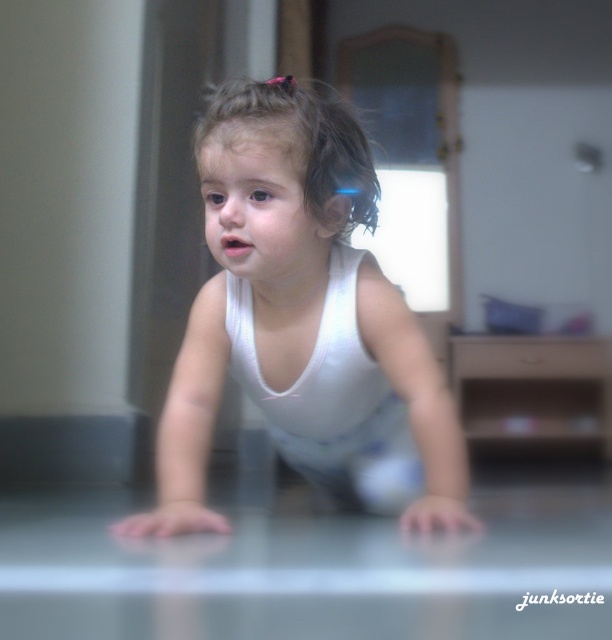
You are a photographer trying to capture a closeup of the white matte toddler at center and the brown curly hair at center. Can you focus on both objects clearly in the same shot without adjusting your camera settings?

The distance between the white matte toddler at center and the brown curly hair at center is 10.63 inches. Since they are very close to each other, you can focus on both objects clearly in the same shot without adjusting your camera settings.

You are a photographer adjusting the lighting in this scene. You need to ensure both the white matte toddler at center and the brown curly hair at center are well lit. Since one is larger than the other, which object should you focus the light on first to ensure proper exposure?

The white matte toddler at center is larger in size than the brown curly hair at center, so you should focus the light on the white matte toddler at center first to ensure proper exposure.